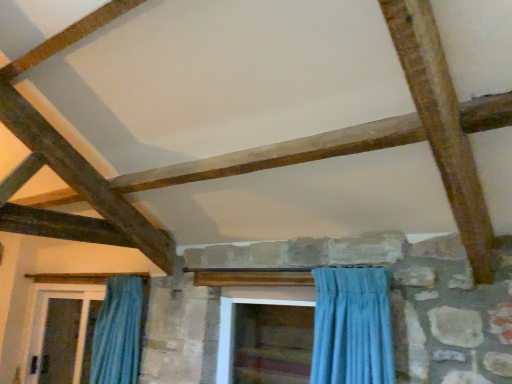
Question: Considering the relative sizes of blue fabric curtain at left and wooden screen door at center, the 1th screen door when ordered from right to left, in the image provided, is blue fabric curtain at left bigger than wooden screen door at center, the 1th screen door when ordered from right to left,?

Choices:
 (A) yes
 (B) no

Answer: (A)

Question: Does blue fabric curtain at left come in front of wooden screen door at center, the 1th screen door when ordered from right to left?

Choices:
 (A) no
 (B) yes

Answer: (A)

Question: Does blue fabric curtain at left appear on the right side of wooden screen door at center, marked as the first screen door in a front-to-back arrangement?

Choices:
 (A) no
 (B) yes

Answer: (A)

Question: Is blue fabric curtain at left taller than wooden screen door at center, marked as the 2th screen door in a left-to-right arrangement?

Choices:
 (A) no
 (B) yes

Answer: (B)

Question: Is blue fabric curtain at left positioned with its back to wooden screen door at center, marked as the first screen door in a front-to-back arrangement?

Choices:
 (A) yes
 (B) no

Answer: (B)

Question: From a real-world perspective, relative to wooden screen door at center, marked as the 2th screen door in a left-to-right arrangement, is clear glass screen door at lower left, which ranks as the 1th screen door in left-to-right order, vertically above or below?

Choices:
 (A) above
 (B) below

Answer: (B)

Question: Considering the positions of clear glass screen door at lower left, arranged as the second screen door when viewed from the front, and wooden screen door at center, marked as the first screen door in a front-to-back arrangement, in the image, is clear glass screen door at lower left, arranged as the second screen door when viewed from the front, wider or thinner than wooden screen door at center, marked as the first screen door in a front-to-back arrangement,?

Choices:
 (A) wide
 (B) thin

Answer: (A)

Question: From the image's perspective, is clear glass screen door at lower left, positioned as the first screen door in back-to-front order, located above or below wooden screen door at center, marked as the first screen door in a front-to-back arrangement?

Choices:
 (A) below
 (B) above

Answer: (A)

Question: Based on their sizes in the image, would you say clear glass screen door at lower left, positioned as the first screen door in back-to-front order, is bigger or smaller than wooden screen door at center, the 1th screen door when ordered from right to left?

Choices:
 (A) small
 (B) big

Answer: (B)

Question: Considering the positions of point (133, 369) and point (253, 301), is point (133, 369) closer or farther from the camera than point (253, 301)?

Choices:
 (A) farther
 (B) closer

Answer: (A)

Question: Looking at their shapes, would you say blue fabric curtain at left is wider or thinner than wooden screen door at center, marked as the first screen door in a front-to-back arrangement?

Choices:
 (A) wide
 (B) thin

Answer: (B)

Question: Is blue fabric curtain at left to the left or to the right of wooden screen door at center, marked as the 2th screen door in a left-to-right arrangement, in the image?

Choices:
 (A) left
 (B) right

Answer: (A)

Question: From a real-world perspective, is blue fabric curtain at left above or below wooden screen door at center, marked as the 2th screen door in a left-to-right arrangement?

Choices:
 (A) below
 (B) above

Answer: (A)

Question: Considering their positions, is wooden screen door at center, marked as the first screen door in a front-to-back arrangement, located in front of or behind blue fabric curtain at left?

Choices:
 (A) behind
 (B) front

Answer: (B)

Question: Is point (224, 380) positioned closer to the camera than point (116, 324)?

Choices:
 (A) closer
 (B) farther

Answer: (A)